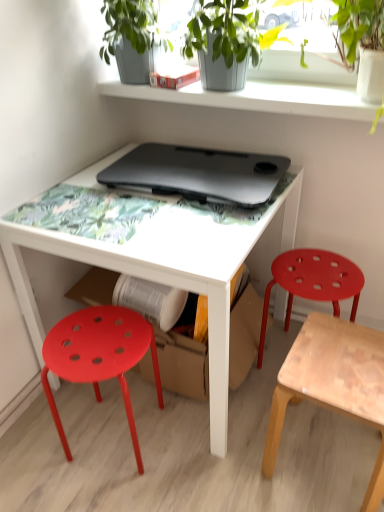
Image resolution: width=384 pixels, height=512 pixels. Identify the location of vacant space in front of black matte laptop at center. (171, 231).